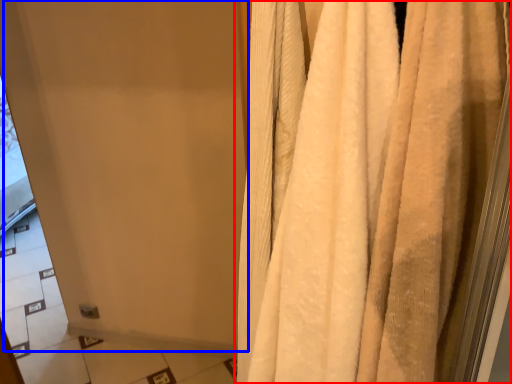
Question: Which of the following is the farthest to the observer, curtain (highlighted by a red box) or screen door (highlighted by a blue box)?

Choices:
 (A) curtain
 (B) screen door

Answer: (B)